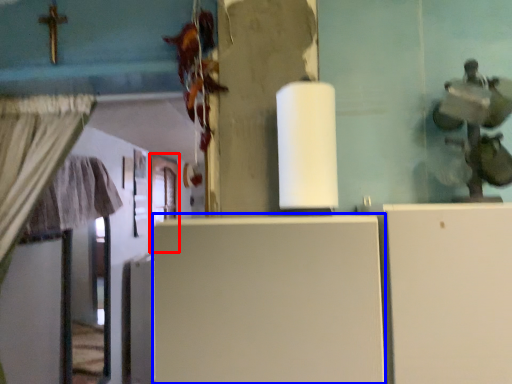
Question: Among these objects, which one is nearest to the camera, door (highlighted by a red box) or fridge (highlighted by a blue box)?

Choices:
 (A) door
 (B) fridge

Answer: (B)